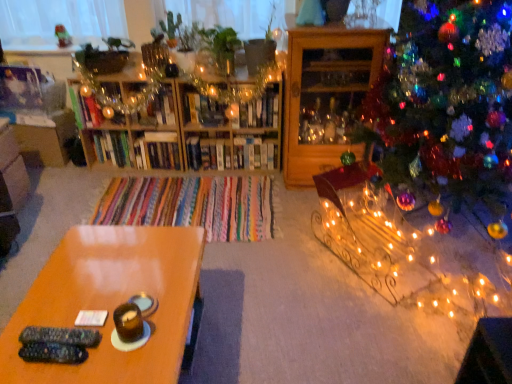
What do you see at coordinates (255, 152) in the screenshot? I see `white glossy bookshelf at center, acting as the 2th shelf starting from the left` at bounding box center [255, 152].

At what (x,y) coordinates should I click in order to perform the action: click on white glossy bookshelf at center, acting as the 2th shelf starting from the left. Please return your answer as a coordinate pair (x, y). This screenshot has width=512, height=384. Looking at the image, I should click on (255, 152).

This screenshot has height=384, width=512. What do you see at coordinates (232, 115) in the screenshot?
I see `wooden bookshelf at center, the third shelf when ordered from right to left` at bounding box center [232, 115].

What is the approximate width of iridescent glass ornaments at right?

It is 1.04 meters.

What is the approximate width of wooden cabinet at right, arranged as the first shelf when viewed from the right?

wooden cabinet at right, arranged as the first shelf when viewed from the right, is 20.00 inches in width.

What are the coordinates of `wooden cabinet at right, arranged as the first shelf when viewed from the right` in the screenshot? It's located at (325, 95).

Identify the location of white glossy bookshelf at center, acting as the 2th shelf starting from the left. (255, 152).

Identify the location of table beneath the wooden bookshelf at center, the third shelf when ordered from right to left (from a real-world perspective). (111, 302).

Can you confirm if glossy wood table at lower left is positioned to the right of wooden bookshelf at center, the third shelf when ordered from right to left?

No.

Looking at this image, can you confirm if glossy wood table at lower left is thinner than wooden bookshelf at center, placed as the first shelf when sorted from left to right?

No.

From the image's perspective, does wooden cabinet at right, arranged as the first shelf when viewed from the right, appear lower than wooden bookshelf at center, placed as the first shelf when sorted from left to right?

No.

Between wooden cabinet at right, arranged as the first shelf when viewed from the right, and wooden bookshelf at center, the third shelf when ordered from right to left, which one has more height?

With more height is wooden cabinet at right, arranged as the first shelf when viewed from the right.

Looking at their sizes, would you say wooden cabinet at right, the 3th shelf in the left-to-right sequence, is wider or thinner than wooden bookshelf at center, placed as the first shelf when sorted from left to right?

In the image, wooden cabinet at right, the 3th shelf in the left-to-right sequence, appears to be wider than wooden bookshelf at center, placed as the first shelf when sorted from left to right.

Which object is further away from the camera taking this photo, wooden cabinet at right, the 3th shelf in the left-to-right sequence, or wooden bookshelf at center, the third shelf when ordered from right to left?

wooden bookshelf at center, the third shelf when ordered from right to left, is further from the camera.

In the image, is iridescent glass ornaments at right on the left side or the right side of glossy wood table at lower left?

iridescent glass ornaments at right is positioned on glossy wood table at lower left's right side.

Does point (397, 168) come farther from viewer compared to point (76, 306)?

That is True.

Is iridescent glass ornaments at right aimed at glossy wood table at lower left?

Yes.

Is glossy wood table at lower left not near iridescent glass ornaments at right?

Yes, glossy wood table at lower left and iridescent glass ornaments at right are quite far apart.

Which is further, [88,272] or [411,67]?

The point [411,67] is farther.

From a real-world perspective, is glossy wood table at lower left above or below iridescent glass ornaments at right?

From a real-world perspective, glossy wood table at lower left is physically below iridescent glass ornaments at right.

Starting from the glossy wood table at lower left, which shelf is the 2nd one to the right? Please provide its 2D coordinates.

[(255, 152)]

Considering the relative positions of white glossy bookshelf at center, acting as the 2th shelf starting from the left, and glossy wood table at lower left in the image provided, is white glossy bookshelf at center, acting as the 2th shelf starting from the left, to the right of glossy wood table at lower left from the viewer's perspective?

Yes.

Considering the relative sizes of white glossy bookshelf at center, acting as the 2th shelf starting from the left, and glossy wood table at lower left in the image provided, is white glossy bookshelf at center, acting as the 2th shelf starting from the left, shorter than glossy wood table at lower left?

Yes, white glossy bookshelf at center, acting as the 2th shelf starting from the left, is shorter than glossy wood table at lower left.

From a real-world perspective, which is physically below, wooden bookshelf at center, placed as the first shelf when sorted from left to right, or white glossy bookshelf at center, the second shelf when ordered from right to left?

white glossy bookshelf at center, the second shelf when ordered from right to left, from a real-world perspective.

Can you confirm if wooden bookshelf at center, the third shelf when ordered from right to left, is thinner than white glossy bookshelf at center, acting as the 2th shelf starting from the left?

Incorrect, the width of wooden bookshelf at center, the third shelf when ordered from right to left, is not less than that of white glossy bookshelf at center, acting as the 2th shelf starting from the left.

Considering the relative sizes of wooden bookshelf at center, placed as the first shelf when sorted from left to right, and white glossy bookshelf at center, the second shelf when ordered from right to left, in the image provided, is wooden bookshelf at center, placed as the first shelf when sorted from left to right, smaller than white glossy bookshelf at center, the second shelf when ordered from right to left,?

Incorrect, wooden bookshelf at center, placed as the first shelf when sorted from left to right, is not smaller in size than white glossy bookshelf at center, the second shelf when ordered from right to left.

Which of these two, wooden cabinet at right, the 3th shelf in the left-to-right sequence, or white glossy bookshelf at center, acting as the 2th shelf starting from the left, is wider?

Wider between the two is wooden cabinet at right, the 3th shelf in the left-to-right sequence.

Is wooden cabinet at right, arranged as the first shelf when viewed from the right, situated inside white glossy bookshelf at center, the second shelf when ordered from right to left, or outside?

wooden cabinet at right, arranged as the first shelf when viewed from the right, is spatially situated outside white glossy bookshelf at center, the second shelf when ordered from right to left.

Is point (324, 46) closer or farther from the camera than point (234, 154)?

Point (324, 46).

Which object is positioned more to the left, wooden cabinet at right, arranged as the first shelf when viewed from the right, or white glossy bookshelf at center, acting as the 2th shelf starting from the left?

From the viewer's perspective, white glossy bookshelf at center, acting as the 2th shelf starting from the left, appears more on the left side.

Identify the location of the 2nd shelf behind the glossy wood table at lower left, starting your count from the anchor. (232, 115).

Locate an element on the screen. the 2nd shelf counting from the right side of the wooden bookshelf at center, placed as the first shelf when sorted from left to right is located at coordinates (325, 95).

Based on their spatial positions, is white glossy bookshelf at center, the second shelf when ordered from right to left, or wooden bookshelf at center, placed as the first shelf when sorted from left to right, closer to iridescent glass ornaments at right?

wooden bookshelf at center, placed as the first shelf when sorted from left to right, is closer to iridescent glass ornaments at right.

Estimate the real-world distances between objects in this image. Which object is closer to white glossy bookshelf at center, the second shelf when ordered from right to left, iridescent glass ornaments at right or wooden cabinet at right, arranged as the first shelf when viewed from the right?

wooden cabinet at right, arranged as the first shelf when viewed from the right.

When comparing their distances from glossy wood table at lower left, does iridescent glass ornaments at right or white glossy bookshelf at center, acting as the 2th shelf starting from the left, seem closer?

iridescent glass ornaments at right.

Which object lies nearer to the anchor point glossy wood table at lower left, white glossy bookshelf at center, acting as the 2th shelf starting from the left, or wooden bookshelf at center, the third shelf when ordered from right to left?

Among the two, wooden bookshelf at center, the third shelf when ordered from right to left, is located nearer to glossy wood table at lower left.

Looking at the image, which one is located further to wooden bookshelf at center, the third shelf when ordered from right to left, iridescent glass ornaments at right or glossy wood table at lower left?

Among the two, glossy wood table at lower left is located further to wooden bookshelf at center, the third shelf when ordered from right to left.

Looking at this image, looking at the image, which one is located closer to white glossy bookshelf at center, acting as the 2th shelf starting from the left, wooden cabinet at right, arranged as the first shelf when viewed from the right, or iridescent glass ornaments at right?

Among the two, wooden cabinet at right, arranged as the first shelf when viewed from the right, is located nearer to white glossy bookshelf at center, acting as the 2th shelf starting from the left.

Which object lies further to the anchor point glossy wood table at lower left, wooden cabinet at right, the 3th shelf in the left-to-right sequence, or wooden bookshelf at center, the third shelf when ordered from right to left?

wooden bookshelf at center, the third shelf when ordered from right to left, is positioned further to the anchor glossy wood table at lower left.

When comparing their distances from glossy wood table at lower left, does white glossy bookshelf at center, the second shelf when ordered from right to left, or iridescent glass ornaments at right seem closer?

Among the two, iridescent glass ornaments at right is located nearer to glossy wood table at lower left.

The image size is (512, 384). In order to click on shelf located between wooden cabinet at right, arranged as the first shelf when viewed from the right, and white glossy bookshelf at center, acting as the 2th shelf starting from the left, in the depth direction in this screenshot , I will do `click(232, 115)`.

The width and height of the screenshot is (512, 384). I want to click on shelf between glossy wood table at lower left and wooden bookshelf at center, placed as the first shelf when sorted from left to right, from front to back, so click(x=325, y=95).

What are the coordinates of `christmas tree located between glossy wood table at lower left and wooden bookshelf at center, the third shelf when ordered from right to left, in the depth direction` in the screenshot? It's located at (447, 102).

Where is `christmas tree positioned between glossy wood table at lower left and white glossy bookshelf at center, acting as the 2th shelf starting from the left, from near to far`? This screenshot has height=384, width=512. christmas tree positioned between glossy wood table at lower left and white glossy bookshelf at center, acting as the 2th shelf starting from the left, from near to far is located at coordinates tap(447, 102).